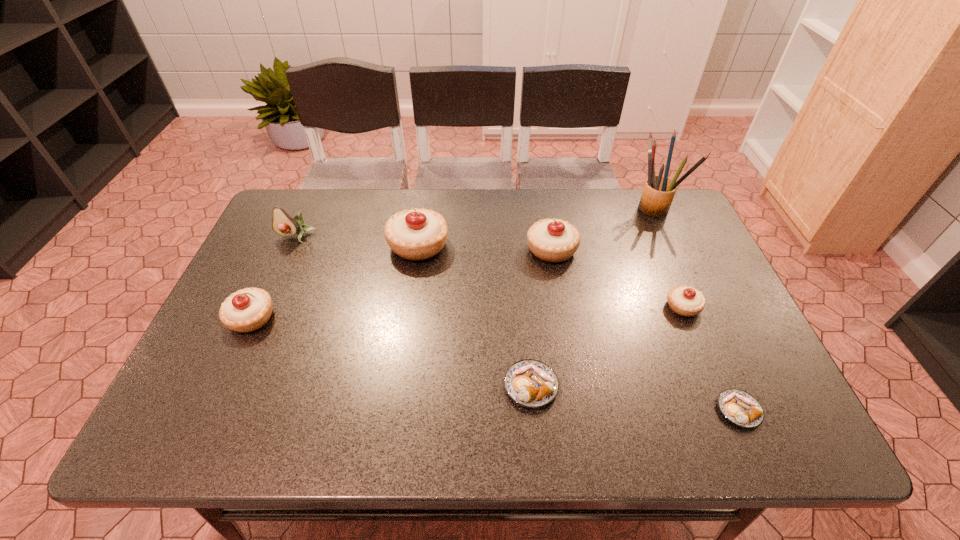
Where is `object positioned at the near right corner`? object positioned at the near right corner is located at coordinates (739, 407).

Identify the location of vacant space at the far edge of the desktop. Image resolution: width=960 pixels, height=540 pixels. (496, 204).

The height and width of the screenshot is (540, 960). In the image, there is a desktop. In order to click on vacant space at the near edge in this screenshot , I will do `click(257, 431)`.

The width and height of the screenshot is (960, 540). Find the location of `vacant area at the left edge`. vacant area at the left edge is located at coordinates (287, 260).

In the image, there is a desktop. Find the location of `free space at the right edge`. free space at the right edge is located at coordinates (749, 330).

This screenshot has width=960, height=540. In order to click on vacant point located between the tallest pastry and the third shortest object in this screenshot , I will do `click(551, 276)`.

Identify the location of empty space that is in between the fifth shortest pastry and the farthest object. The image size is (960, 540). (604, 228).

Locate an element on the screen. free space that is in between the tallest pastry and the leftmost beige pastry is located at coordinates (335, 281).

I want to click on blank region between the fifth pastry from right to left and the avocado, so click(357, 241).

Locate an element on the screen. The image size is (960, 540). free space between the rightmost beige pastry and the biggest beige pastry is located at coordinates (551, 276).